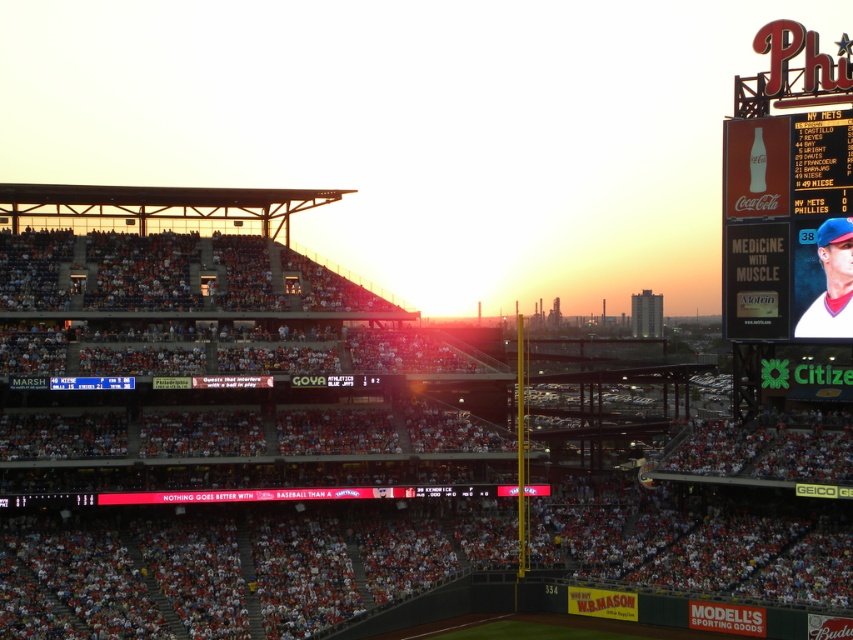
You are a photographer at the baseball stadium and want to capture a photo of the white jersey baseball player at upper right and the red plastic scoreboard at upper right without any overlap. Given that the player might be wider than the scoreboard, could you position yourself so that both are fully visible in the frame?

The white jersey baseball player at upper right might be wider than the red plastic scoreboard at upper right. To ensure both are fully visible, position yourself such that the player is slightly to one side of the frame, allowing space for the scoreboard on the opposite side, as the player requires more width due to their potential larger size.

You are a photographer at the baseball stadium and want to capture a photo that includes both the white jersey baseball player at upper right and the red plastic scoreboard at upper right. Given that your camera has a maximum focus range of 70 feet, will you be able to include both in the same shot without moving the camera?

The white jersey baseball player at upper right and the red plastic scoreboard at upper right are 70.56 feet apart. Since the camera can only focus up to 70 feet, the distance between them exceeds the maximum focus range. Therefore, you won

You are a photographer at the baseball stadium and want to capture a photo of the white jersey baseball player at upper right without the red plastic scoreboard at upper right appearing in the background. Is this possible based on their positions?

The white jersey baseball player at upper right is in front of the red plastic scoreboard at upper right. Therefore, the scoreboard will be visible behind the player in the photo, making it impossible to capture the player without the scoreboard in the background.